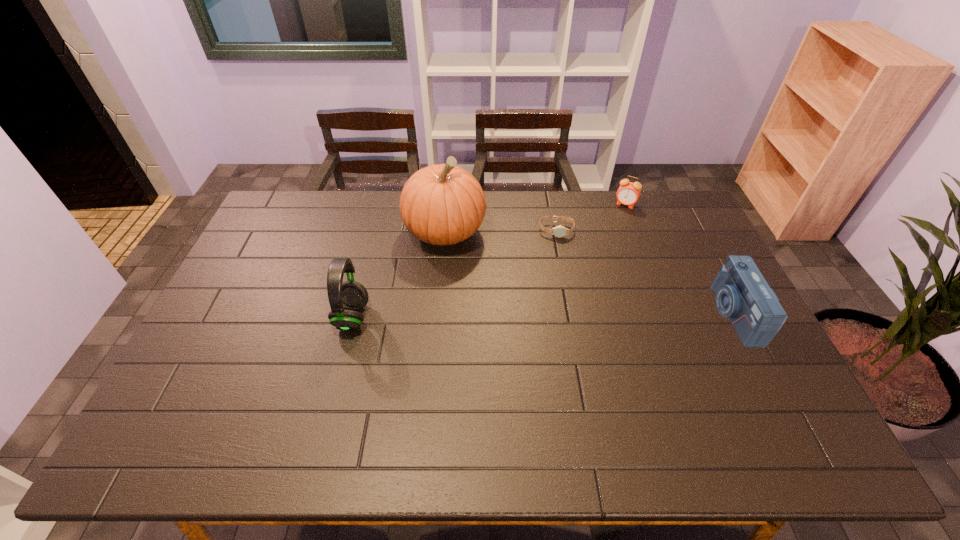
Locate an element on the screen. This screenshot has height=540, width=960. free location located on the ear cups of the second tallest object is located at coordinates (304, 316).

The height and width of the screenshot is (540, 960). In order to click on free space located 0.220m on the ear cups of the second tallest object in this screenshot , I will do `click(260, 316)`.

Locate an element on the screen. The image size is (960, 540). blank space located on the lens of the rightmost object is located at coordinates (581, 314).

In order to click on vacant space located on the lens of the rightmost object in this screenshot , I will do `click(686, 314)`.

Where is `free space located 0.360m on the lens of the rightmost object`? The width and height of the screenshot is (960, 540). free space located 0.360m on the lens of the rightmost object is located at coordinates (594, 314).

Image resolution: width=960 pixels, height=540 pixels. I want to click on free space located 0.160m on the stem of the pumpkin, so click(x=476, y=292).

At what (x,y) coordinates should I click in order to perform the action: click on vacant space located on the stem of the pumpkin. Please return your answer as a coordinate pair (x, y). Looking at the image, I should click on (492, 320).

At what (x,y) coordinates should I click in order to perform the action: click on vacant space situated 0.070m on the stem of the pumpkin. Please return your answer as a coordinate pair (x, y). This screenshot has height=540, width=960. Looking at the image, I should click on (467, 272).

Where is `vacant position located 0.080m on the face of the shortest object`? Image resolution: width=960 pixels, height=540 pixels. vacant position located 0.080m on the face of the shortest object is located at coordinates (558, 254).

The width and height of the screenshot is (960, 540). Find the location of `vacant space situated 0.080m on the face of the shortest object`. vacant space situated 0.080m on the face of the shortest object is located at coordinates (558, 254).